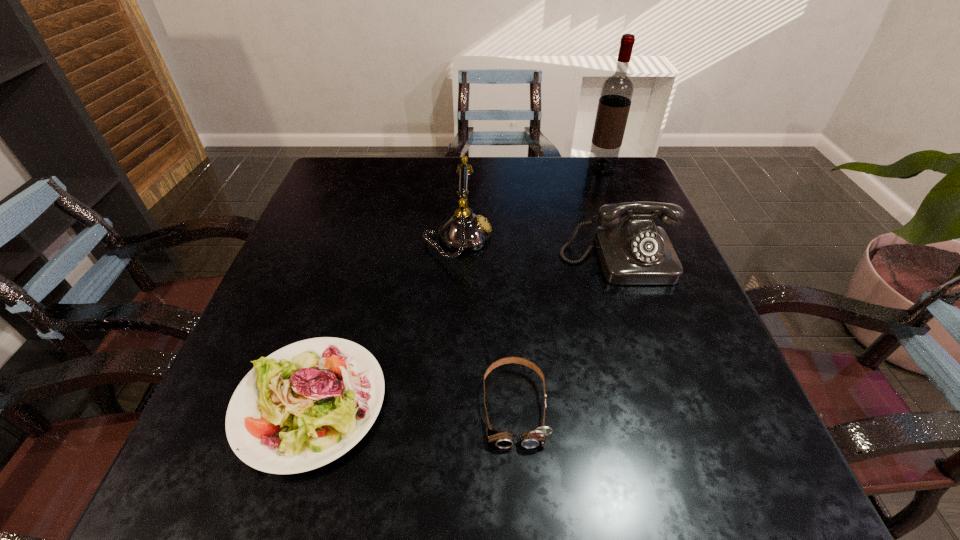
Where is `object present at the far right corner`? The width and height of the screenshot is (960, 540). object present at the far right corner is located at coordinates (617, 90).

Image resolution: width=960 pixels, height=540 pixels. Identify the location of free space at the far edge of the desktop. (479, 173).

You are a GUI agent. You are given a task and a screenshot of the screen. Output one action in this format:
    pyautogui.click(x=<x>, y=<y>)
    Task: Click on the free region at the near edge
    This screenshot has width=960, height=540.
    Given the screenshot: What is the action you would take?
    pyautogui.click(x=473, y=470)

In the image, there is a desktop. Where is `vacant space at the left edge`? vacant space at the left edge is located at coordinates (289, 254).

Locate an element on the screen. free space at the far left corner of the desktop is located at coordinates (375, 159).

In the image, there is a desktop. What are the coordinates of `free space at the far right corner` in the screenshot? It's located at (619, 157).

In order to click on vacant area that lies between the leftmost object and the third tallest object in this screenshot , I will do `click(464, 331)`.

At what (x,y) coordinates should I click in order to perform the action: click on free spot between the wine bottle and the salad plate. Please return your answer as a coordinate pair (x, y). The height and width of the screenshot is (540, 960). Looking at the image, I should click on (456, 285).

This screenshot has width=960, height=540. I want to click on unoccupied area between the leftmost object and the tallest object, so click(456, 285).

Identify the location of empty space between the taller telephone and the third tallest object. The image size is (960, 540). (538, 248).